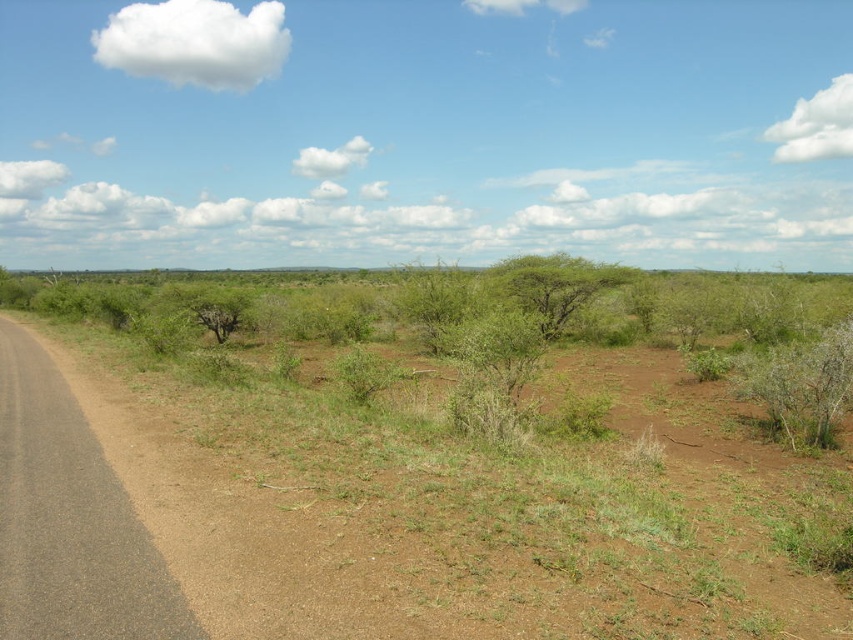
Who is more distant from viewer, (792, 369) or (576, 268)?

The point (576, 268) is more distant.

Where is `green leafy bush at right`? This screenshot has height=640, width=853. green leafy bush at right is located at coordinates (801, 385).